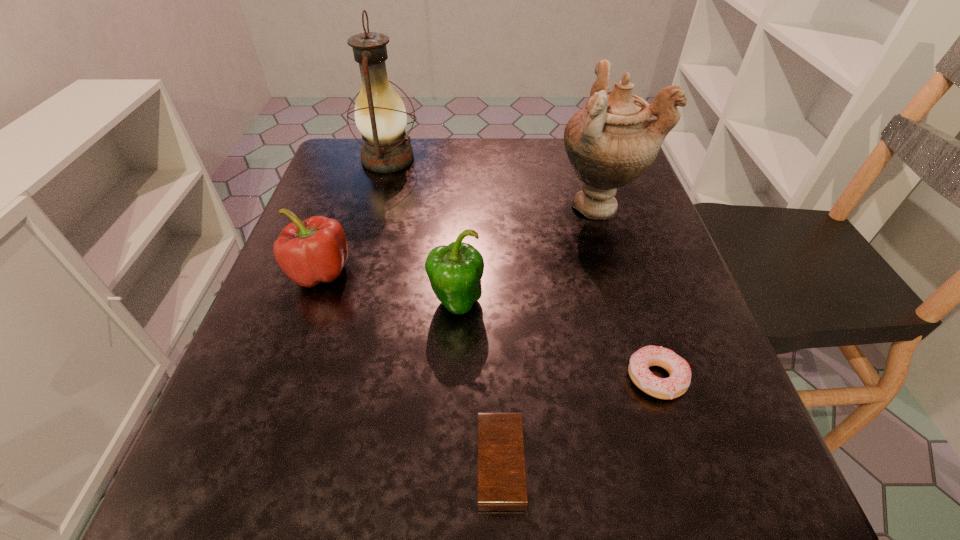
The width and height of the screenshot is (960, 540). In order to click on free space located on the right of the oil lamp in this screenshot , I will do `click(461, 159)`.

Where is `free space located on the back of the second tallest object`? This screenshot has width=960, height=540. free space located on the back of the second tallest object is located at coordinates (582, 148).

At what (x,y) coordinates should I click in order to perform the action: click on vacant space located 0.120m on the right of the third tallest object. Please return your answer as a coordinate pair (x, y). This screenshot has width=960, height=540. Looking at the image, I should click on (552, 303).

This screenshot has width=960, height=540. In order to click on free space located on the back of the fourth tallest object in this screenshot , I will do (344, 205).

Locate an element on the screen. This screenshot has height=540, width=960. vacant space located 0.120m on the front of the doughnut is located at coordinates (694, 492).

What are the coordinates of `blank space located 0.230m on the front face of the alarm clock` in the screenshot? It's located at (304, 463).

The width and height of the screenshot is (960, 540). Find the location of `free space located on the front face of the alarm clock`. free space located on the front face of the alarm clock is located at coordinates (258, 463).

The height and width of the screenshot is (540, 960). In order to click on free space located 0.240m on the front face of the alarm clock in this screenshot , I will do `click(297, 463)`.

Image resolution: width=960 pixels, height=540 pixels. I want to click on oil lamp situated at the far edge, so click(380, 115).

Image resolution: width=960 pixels, height=540 pixels. In order to click on urn that is positioned at the far edge in this screenshot , I will do `click(612, 141)`.